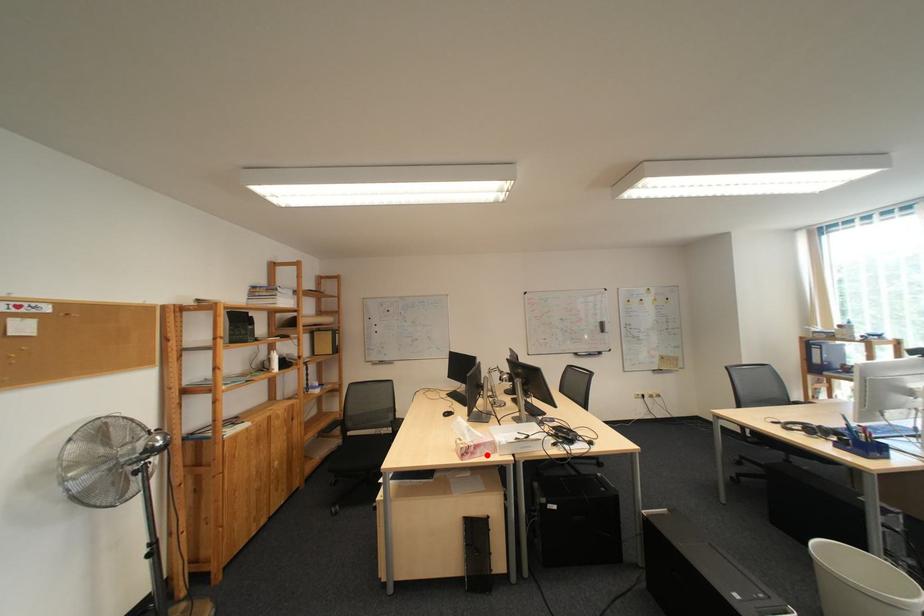
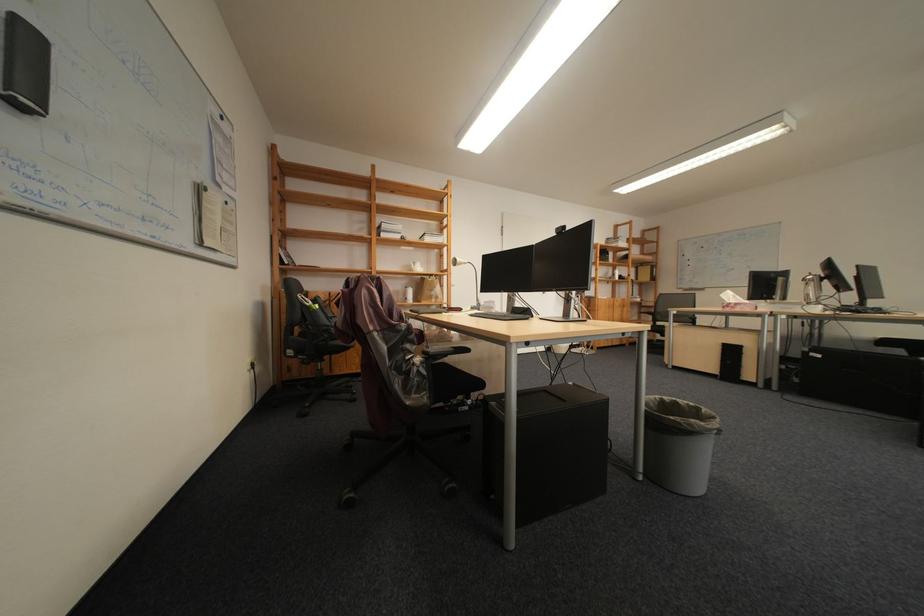
In the second image, find the point that corresponds to the highlighted location in the first image.

(747, 309)